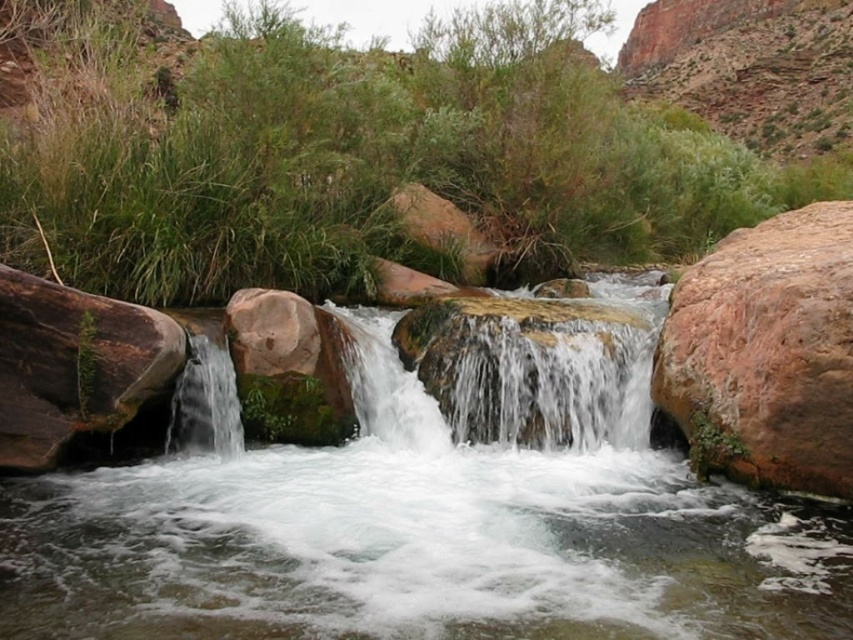
Question: Is green grass at upper center to the left of rusty stone boulder at right from the viewer's perspective?

Choices:
 (A) no
 (B) yes

Answer: (A)

Question: Estimate the real-world distances between objects in this image. Which object is farther from the clear water at left?

Choices:
 (A) clear water at center
 (B) rusty stone boulder at right

Answer: (B)

Question: Considering the real-world distances, which object is closest to the clear water at center?

Choices:
 (A) green grass at upper center
 (B) rusty stone boulder at right
 (C) clear water at left

Answer: (C)

Question: Is clear water at center further to the viewer compared to rusty stone boulder at right?

Choices:
 (A) yes
 (B) no

Answer: (B)

Question: Does rusty stone boulder at right have a greater width compared to clear water at left?

Choices:
 (A) no
 (B) yes

Answer: (A)

Question: Considering the real-world distances, which object is closest to the clear water at left?

Choices:
 (A) clear water at center
 (B) rusty stone boulder at right

Answer: (A)